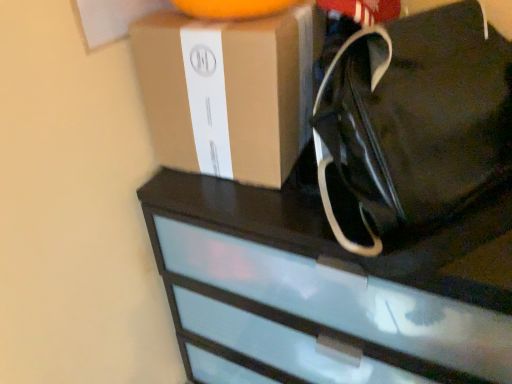
Question: Considering the positions of point (202, 28) and point (507, 150), is point (202, 28) closer or farther from the camera than point (507, 150)?

Choices:
 (A) farther
 (B) closer

Answer: (B)

Question: Considering the positions of brown cardboard box at upper center and black fabric tote at upper right in the image, is brown cardboard box at upper center bigger or smaller than black fabric tote at upper right?

Choices:
 (A) small
 (B) big

Answer: (A)

Question: Which object is the farthest from the brown cardboard box at upper center?

Choices:
 (A) black fabric tote at upper right
 (B) black glossy chest of drawers at upper center

Answer: (B)

Question: Based on their relative distances, which object is farther from the black fabric tote at upper right?

Choices:
 (A) black glossy chest of drawers at upper center
 (B) brown cardboard box at upper center

Answer: (A)